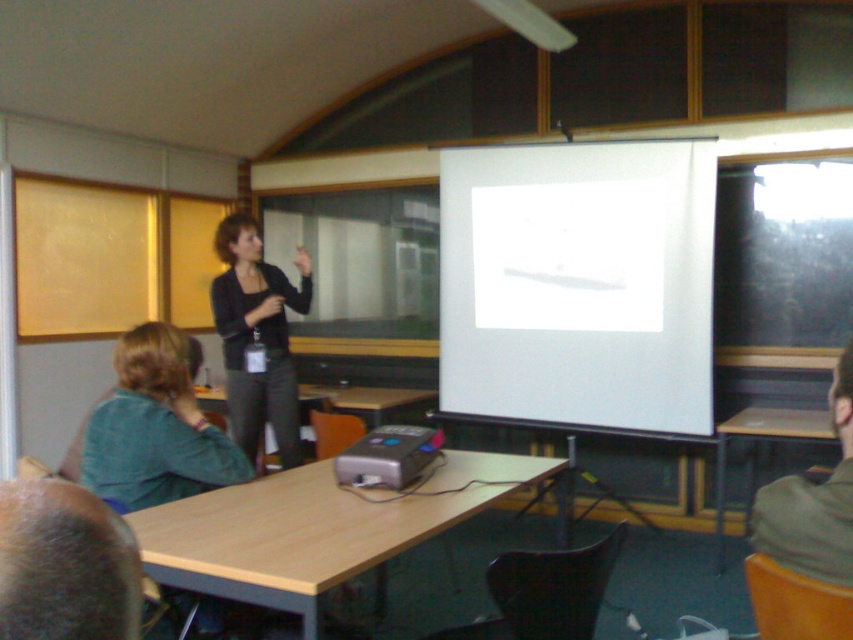
Question: Is the position of white matte projection screen at center less distant than that of green fabric shirt at lower left?

Choices:
 (A) no
 (B) yes

Answer: (A)

Question: Can you confirm if metallic gray projector at center is thinner than wooden table at lower right?

Choices:
 (A) no
 (B) yes

Answer: (B)

Question: Does green fabric shirt at lower left appear on the right side of wooden table at lower right?

Choices:
 (A) yes
 (B) no

Answer: (B)

Question: Which point is closer to the camera taking this photo?

Choices:
 (A) (410, 456)
 (B) (811, 428)

Answer: (A)

Question: Which point is closer to the camera taking this photo?

Choices:
 (A) (693, 392)
 (B) (747, 412)
 (C) (468, 509)

Answer: (C)

Question: Which of the following is the farthest from the observer?

Choices:
 (A) green fabric shirt at lower left
 (B) wooden table at lower right

Answer: (B)